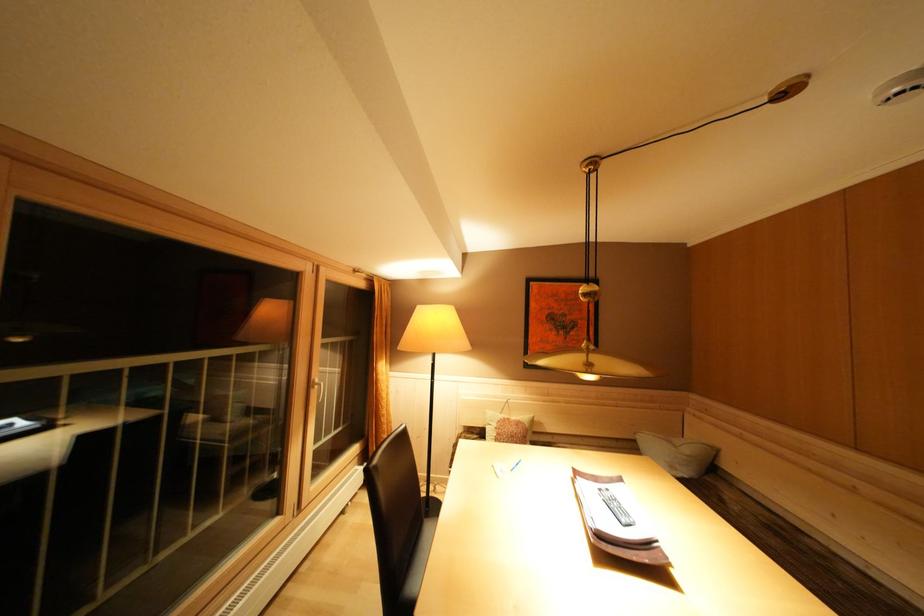
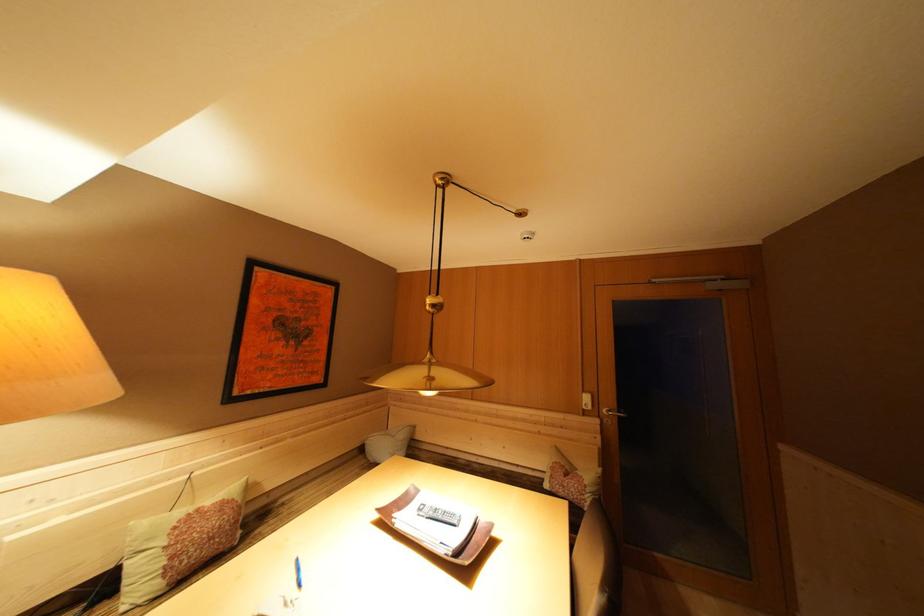
Find the pixel in the second image that matches point (608, 495) in the first image.

(427, 515)